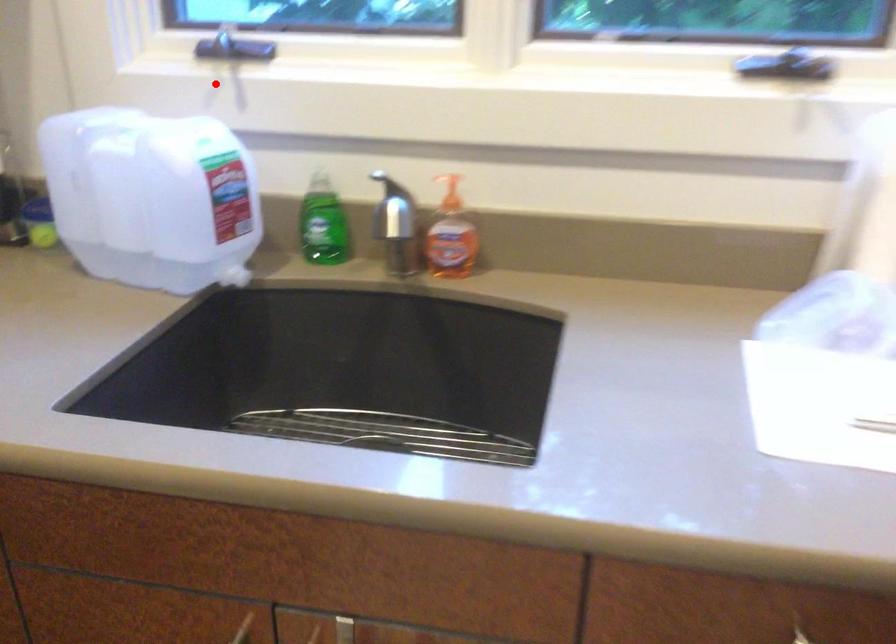
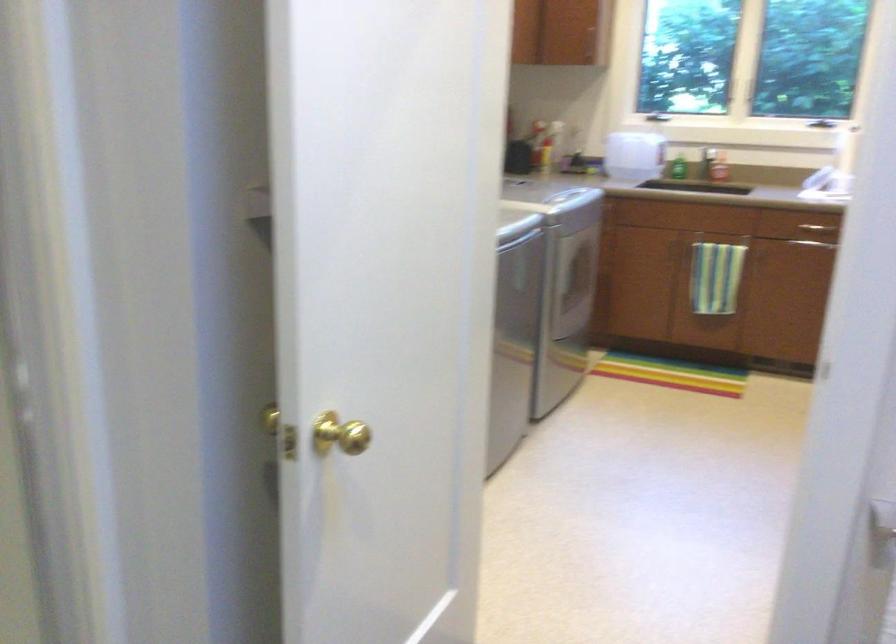
Question: A red point is marked in image1. In image2, is the corresponding 3D point closer to the camera or farther? Reply with the corresponding letter.

Choices:
 (A) The corresponding 3D point is closer.
 (B) The corresponding 3D point is farther.

Answer: (B)